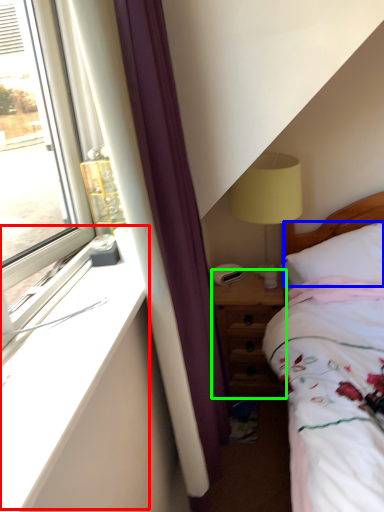
Question: Which object is the farthest from window sill (highlighted by a red box)? Choose among these: pillow (highlighted by a blue box) or nightstand (highlighted by a green box).

Choices:
 (A) pillow
 (B) nightstand

Answer: (A)